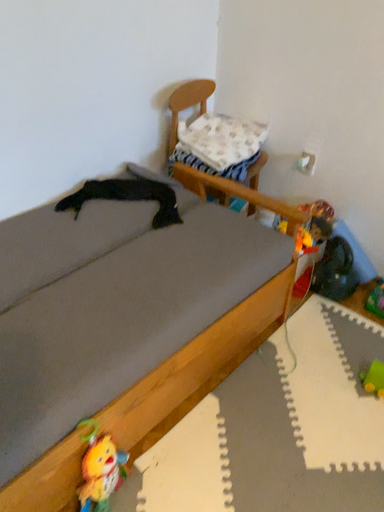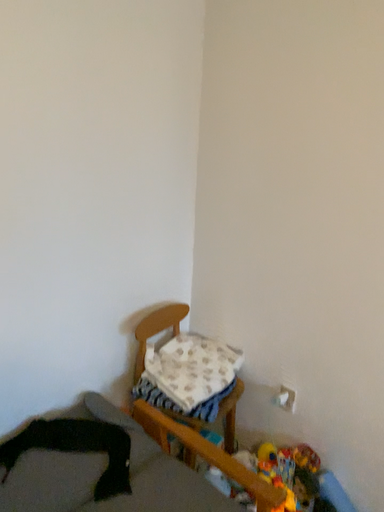
Question: How did the camera likely rotate when shooting the video?

Choices:
 (A) rotated upward
 (B) rotated downward

Answer: (A)